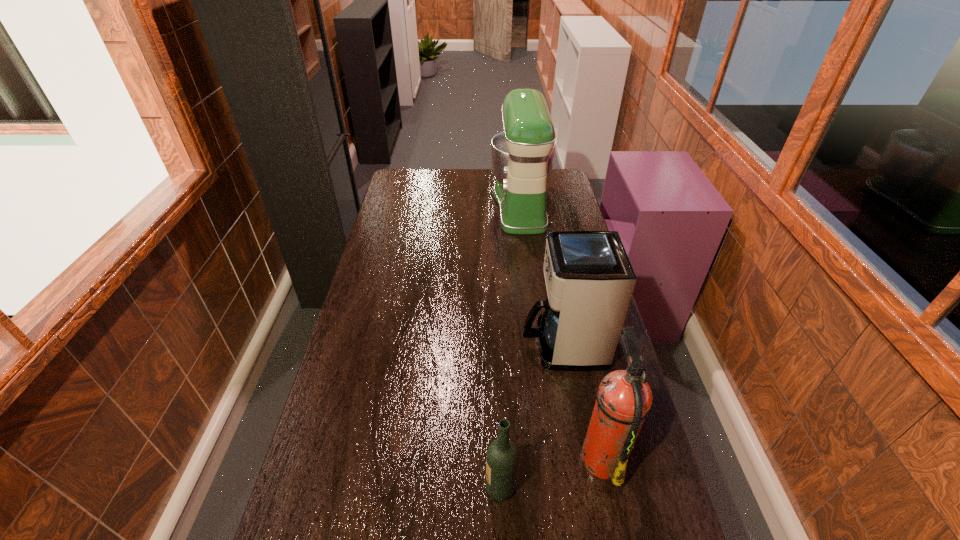
Identify the location of free space located on the front panel of the third nearest object. This screenshot has height=540, width=960. (491, 345).

The image size is (960, 540). In order to click on vacant space located on the front panel of the third nearest object in this screenshot , I will do `click(450, 345)`.

The width and height of the screenshot is (960, 540). I want to click on free space located on the front panel of the third nearest object, so click(x=472, y=345).

Where is `vacant region located on the labeled side of the wine bottle`? Image resolution: width=960 pixels, height=540 pixels. vacant region located on the labeled side of the wine bottle is located at coordinates (461, 488).

Locate an element on the screen. Image resolution: width=960 pixels, height=540 pixels. blank space located 0.170m on the labeled side of the wine bottle is located at coordinates (416, 488).

The image size is (960, 540). Identify the location of free space located 0.130m on the labeled side of the wine bottle. (432, 488).

At what (x,y) coordinates should I click in order to perform the action: click on object that is at the far edge. Please return your answer as a coordinate pair (x, y). The height and width of the screenshot is (540, 960). Looking at the image, I should click on (522, 156).

Find the location of `mixer that is at the right edge`. mixer that is at the right edge is located at coordinates (522, 156).

Where is `fire extinguisher located in the right edge section of the desktop`? fire extinguisher located in the right edge section of the desktop is located at coordinates (624, 398).

The height and width of the screenshot is (540, 960). I want to click on coffee maker located at the right edge, so click(x=589, y=279).